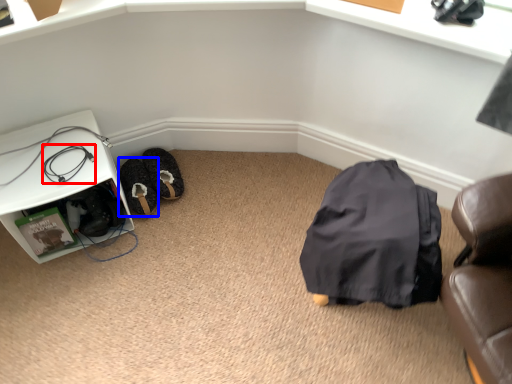
Question: Which object is closer to the camera taking this photo, wire (highlighted by a red box) or shoe (highlighted by a blue box)?

Choices:
 (A) wire
 (B) shoe

Answer: (A)